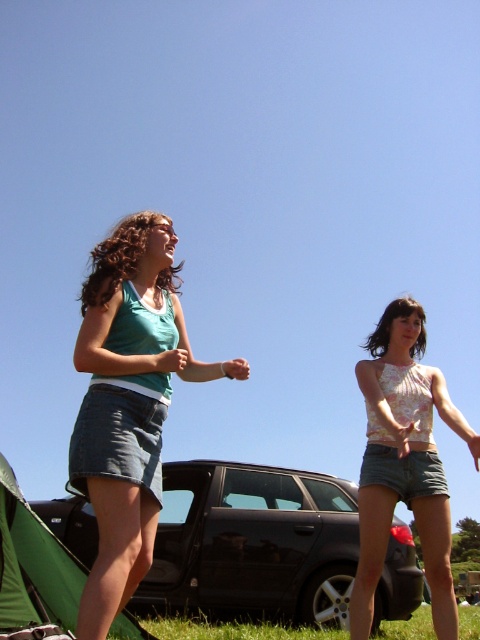
Question: Which object is the farthest from the green fabric tent at lower left?

Choices:
 (A) denim skirt at left
 (B) green grass at lower center

Answer: (B)

Question: Which point appears closest to the camera in this image?

Choices:
 (A) (131, 292)
 (B) (0, 513)
 (C) (474, 628)
 (D) (422, 312)

Answer: (A)

Question: Does denim skirt at left have a lesser width compared to floral halter top at center?

Choices:
 (A) yes
 (B) no

Answer: (B)

Question: Can you confirm if black metallic car at center is positioned below green grass at lower center?

Choices:
 (A) yes
 (B) no

Answer: (B)

Question: Is black metallic car at center smaller than denim skirt at left?

Choices:
 (A) yes
 (B) no

Answer: (B)

Question: Which object is positioned closest to the floral halter top at center?

Choices:
 (A) green grass at lower center
 (B) green fabric tent at lower left

Answer: (B)